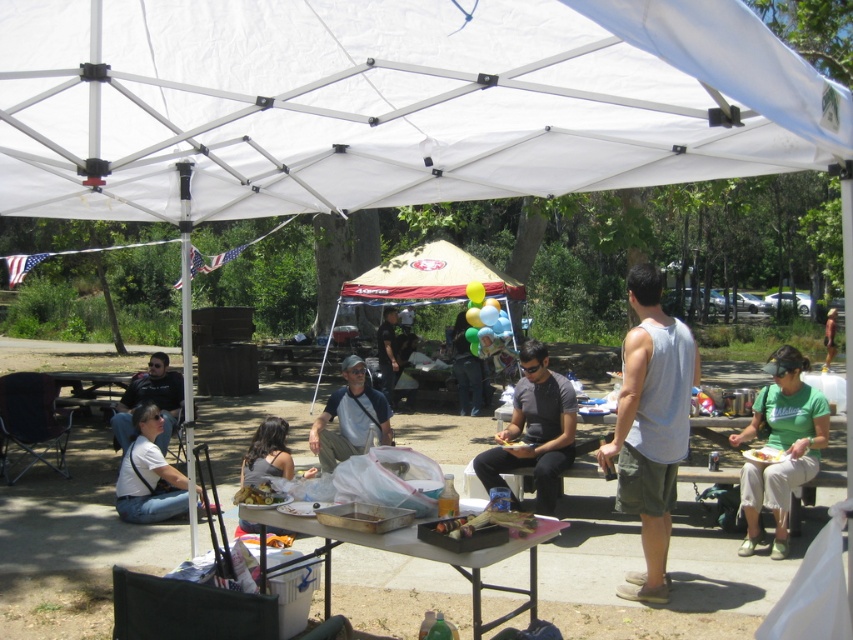
Question: Which of the following is the farthest from the observer?

Choices:
 (A) green cotton shirt at lower right
 (B) dark blue jeans at center
 (C) dark gray fabric jacket at center
 (D) red fabric tent at center

Answer: (B)

Question: Which point is farther to the camera?

Choices:
 (A) (485, 586)
 (B) (476, 401)
 (C) (833, 349)
 (D) (170, 465)

Answer: (C)

Question: Is white fabric canopy at upper center bigger than white matte shirt at lower left?

Choices:
 (A) yes
 (B) no

Answer: (A)

Question: Is gray cotton tank top at right behind light brown fabric shirt at right?

Choices:
 (A) no
 (B) yes

Answer: (A)

Question: Does red fabric tent at center come behind brown wooden picnic table at lower left?

Choices:
 (A) yes
 (B) no

Answer: (A)

Question: Which of the following is the closest to the observer?

Choices:
 (A) (62, 97)
 (B) (358, 300)
 (C) (248, 465)
 (D) (120, 426)

Answer: (A)